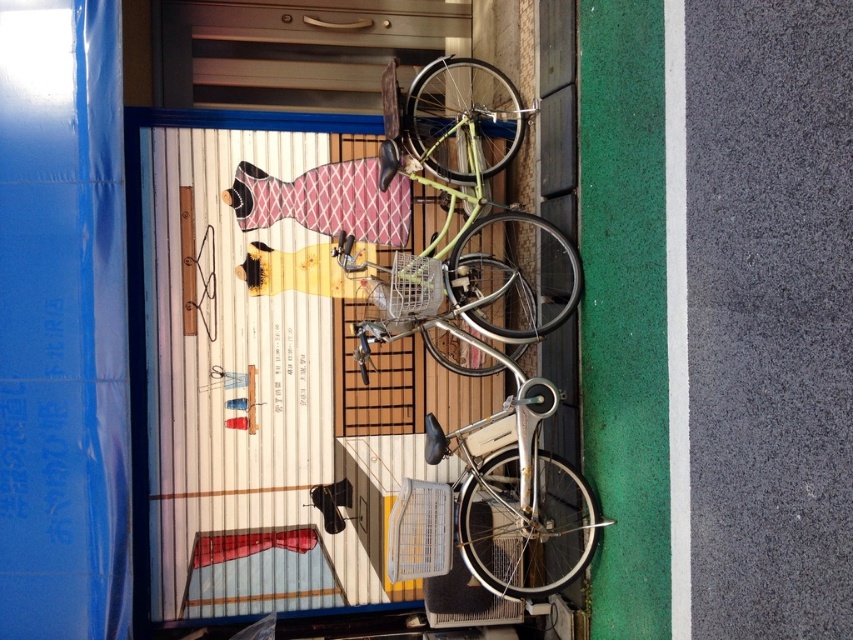
Question: Which object appears farthest from the camera in this image?

Choices:
 (A) metallic silver door at center
 (B) metallic wire basket at center

Answer: (A)

Question: Is plastic basket at center further to camera compared to metallic wire basket at center?

Choices:
 (A) yes
 (B) no

Answer: (B)

Question: Which of the following is the farthest from the observer?

Choices:
 (A) light green matte bicycle at center
 (B) plastic basket at center
 (C) metallic wire basket at center
 (D) metallic silver door at center

Answer: (D)

Question: Which of the following is the closest to the observer?

Choices:
 (A) metallic wire basket at center
 (B) metallic silver door at center
 (C) plastic basket at center

Answer: (C)

Question: Does metallic silver door at center have a smaller size compared to light green matte bicycle at center?

Choices:
 (A) yes
 (B) no

Answer: (A)

Question: Does metallic silver door at center have a smaller size compared to metallic wire basket at center?

Choices:
 (A) yes
 (B) no

Answer: (B)